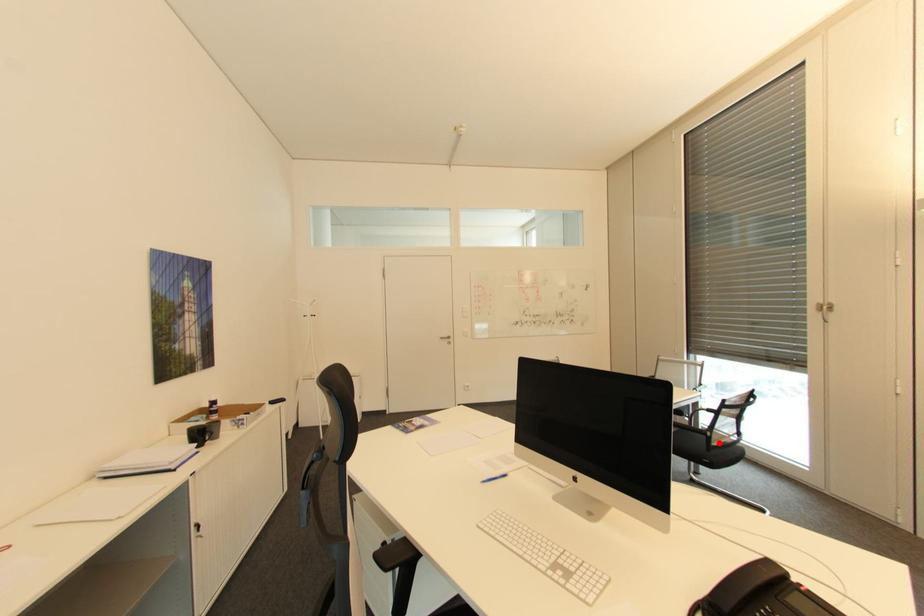
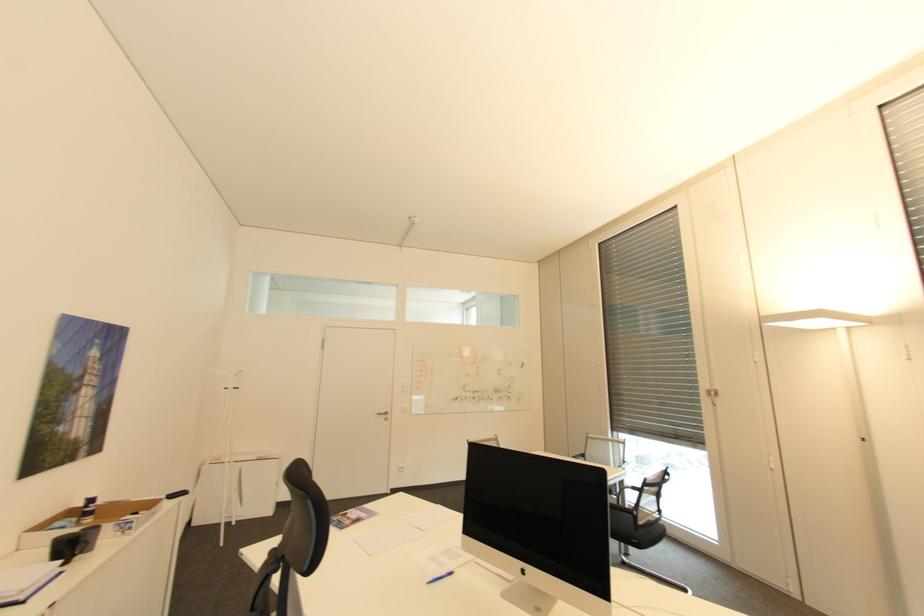
In the second image, find the point that corresponds to the highlighted location in the first image.

(646, 523)